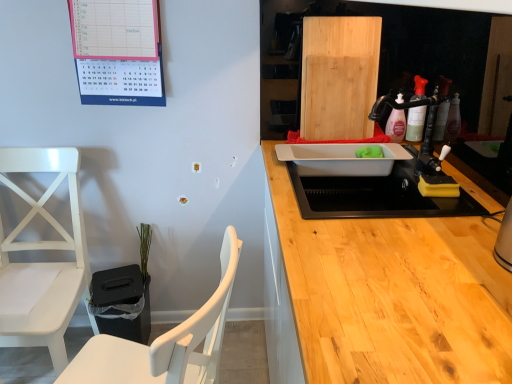
Question: Considering the positions of point (337, 125) and point (138, 76), is point (337, 125) closer or farther from the camera than point (138, 76)?

Choices:
 (A) closer
 (B) farther

Answer: (B)

Question: From their relative heights in the image, would you say natural wood cutting board at upper right is taller or shorter than pink paper calendar at upper left?

Choices:
 (A) tall
 (B) short

Answer: (A)

Question: Based on their relative distances, which object is nearer to the pink paper calendar at upper left?

Choices:
 (A) green matte plant at lower left
 (B) white plastic sink at center, the second sink positioned from the front
 (C) white matte chair at left, the first chair when ordered from left to right
 (D) natural wood cutting board at upper right
 (E) white wood chair at left, placed as the 1th chair when sorted from right to left

Answer: (C)

Question: Based on their relative distances, which object is farther from the white plastic sink at center, which is counted as the 1th sink, starting from the front?

Choices:
 (A) white wood chair at left, placed as the 1th chair when sorted from right to left
 (B) natural wood cutting board at upper right
 (C) white matte chair at left, the first chair when ordered from left to right
 (D) green matte plant at lower left
 (E) pink paper calendar at upper left

Answer: (C)